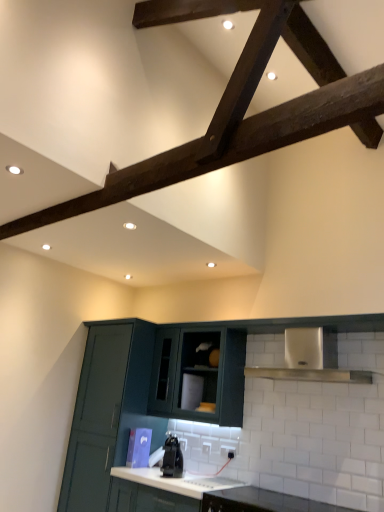
Identify the location of vacant area that is in front of black glossy kettle at center. (180, 480).